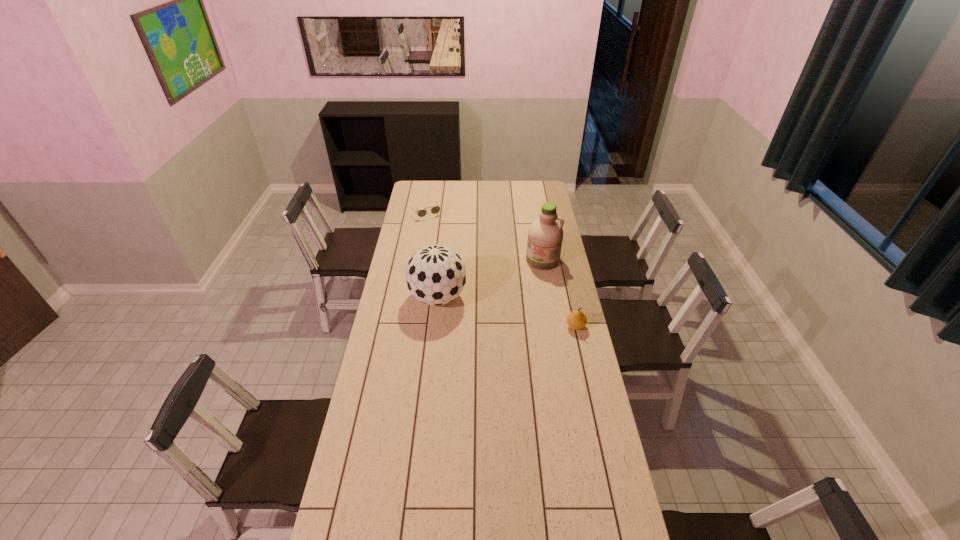
Where is `free space on the desktop that is between the third farthest object and the pear and is positioned on the front label of the tallest object`? The height and width of the screenshot is (540, 960). free space on the desktop that is between the third farthest object and the pear and is positioned on the front label of the tallest object is located at coordinates (518, 314).

At what (x,y) coordinates should I click in order to perform the action: click on free spot on the desktop that is between the third farthest object and the third tallest object and is positioned on the front lenses of the farthest object. Please return your answer as a coordinate pair (x, y). Looking at the image, I should click on (492, 309).